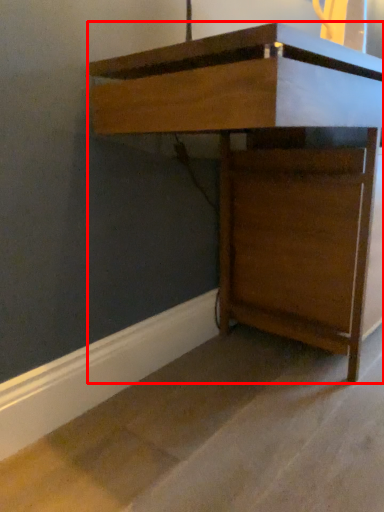
Question: From the image's perspective, where is furniture (annotated by the red box) located relative to concrete?

Choices:
 (A) below
 (B) above

Answer: (B)